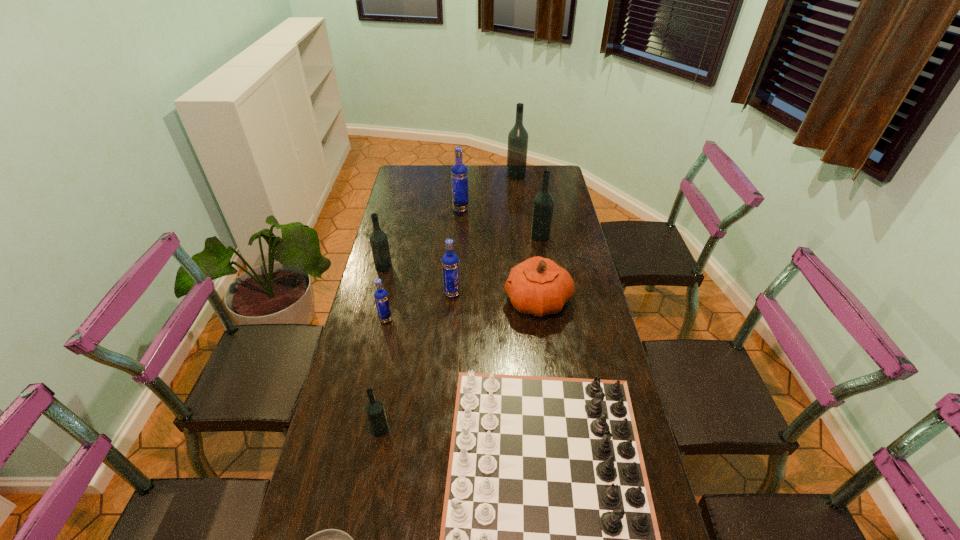
You are a GUI agent. You are given a task and a screenshot of the screen. Output one action in this format:
    pyautogui.click(x=<x>, y=<y>)
    Task: Click on the vacant space at the right edge
    
    Given the screenshot: What is the action you would take?
    pyautogui.click(x=583, y=268)

Where is `free spot between the farthest blue vodka and the second smallest blue vodka`? This screenshot has height=540, width=960. free spot between the farthest blue vodka and the second smallest blue vodka is located at coordinates (456, 252).

Locate an element on the screen. Image resolution: width=960 pixels, height=540 pixels. unoccupied area between the biggest blue vodka and the fourth farthest vodka is located at coordinates (422, 238).

What are the coordinates of `free spot between the second smallest blue vodka and the second nearest black vodka` in the screenshot? It's located at (418, 280).

The height and width of the screenshot is (540, 960). Find the location of `free space between the second smallest blue vodka and the leftmost blue vodka`. free space between the second smallest blue vodka and the leftmost blue vodka is located at coordinates (419, 307).

What are the coordinates of `free point between the second farthest blue vodka and the second nearest vodka` in the screenshot? It's located at (419, 307).

This screenshot has height=540, width=960. I want to click on free space between the third smallest black vodka and the farthest black vodka, so click(x=528, y=206).

Identify which object is the fourth closest to the fourth farthest vodka. Please provide its 2D coordinates. Your answer should be formatted as a tuple, i.e. [(x, y)], where the tuple contains the x and y coordinates of a point satisfying the conditions above.

[(538, 286)]

Where is `the second closest object to the farthest blue vodka`? The image size is (960, 540). the second closest object to the farthest blue vodka is located at coordinates (518, 136).

Identify which vodka is the second nearest to the nearest black vodka. Please provide its 2D coordinates. Your answer should be formatted as a tuple, i.e. [(x, y)], where the tuple contains the x and y coordinates of a point satisfying the conditions above.

[(450, 263)]